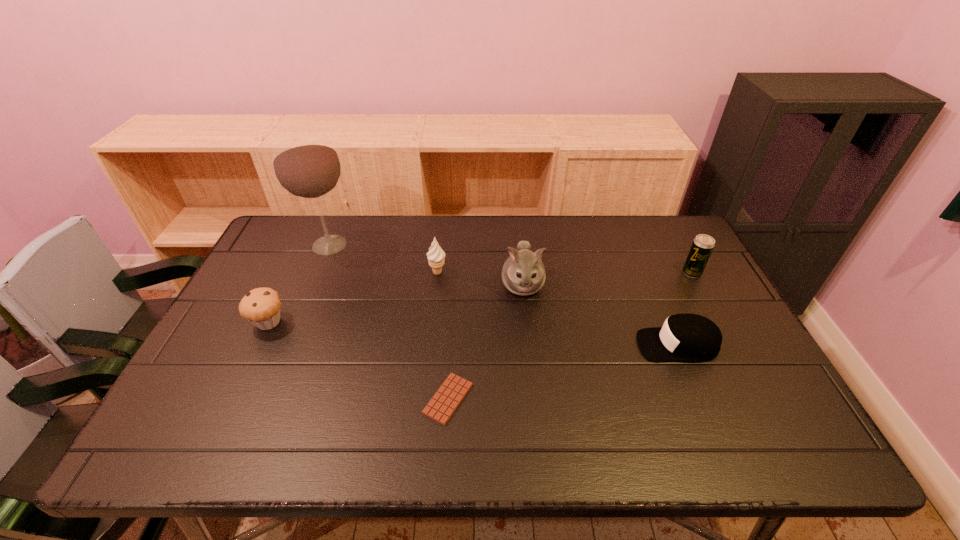
Find the location of a particular element. This screenshot has width=960, height=540. the tallest object is located at coordinates (306, 165).

The height and width of the screenshot is (540, 960). I want to click on the farthest object, so click(306, 165).

This screenshot has width=960, height=540. I want to click on the fifth object from left to right, so click(523, 273).

This screenshot has height=540, width=960. I want to click on icecream, so click(x=436, y=255).

Where is `the rightmost object`? the rightmost object is located at coordinates [x=703, y=245].

At what (x,y) coordinates should I click in order to perform the action: click on the third shortest object. Please return your answer as a coordinate pair (x, y). This screenshot has width=960, height=540. Looking at the image, I should click on (261, 306).

Locate an element on the screen. The height and width of the screenshot is (540, 960). cap is located at coordinates (684, 337).

Where is `the sixth object from left to right`? the sixth object from left to right is located at coordinates (684, 337).

Where is `the nearest object`? This screenshot has height=540, width=960. the nearest object is located at coordinates (446, 400).

Locate an element on the screen. The height and width of the screenshot is (540, 960). the shortest object is located at coordinates (446, 400).